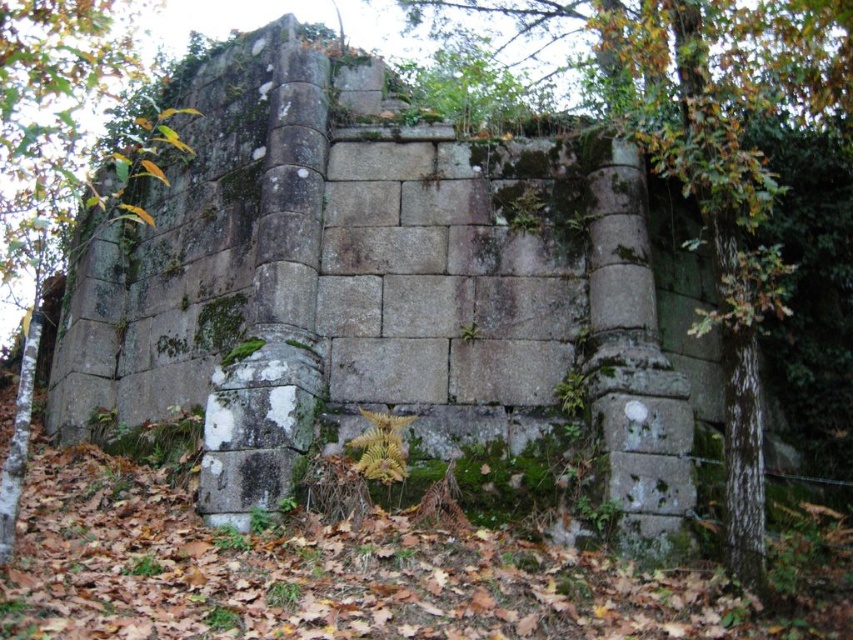
Question: Does green mossy tree at left appear under green leafy ivy at center?

Choices:
 (A) no
 (B) yes

Answer: (A)

Question: Which point appears farthest from the camera in this image?

Choices:
 (A) (376, 467)
 (B) (27, 35)
 (C) (759, 273)

Answer: (B)

Question: From the image, what is the correct spatial relationship of green mossy stone pillar at center in relation to green leafy ivy at center?

Choices:
 (A) right
 (B) left

Answer: (A)

Question: Estimate the real-world distances between objects in this image. Which object is farther from the green mossy tree at left?

Choices:
 (A) green mossy stone pillar at center
 (B) green leafy ivy at center

Answer: (A)

Question: Estimate the real-world distances between objects in this image. Which object is farther from the green mossy tree at left?

Choices:
 (A) green leafy ivy at center
 (B) green mossy stone pillar at center

Answer: (B)

Question: Does green mossy tree at left appear on the left side of green leafy ivy at center?

Choices:
 (A) yes
 (B) no

Answer: (A)